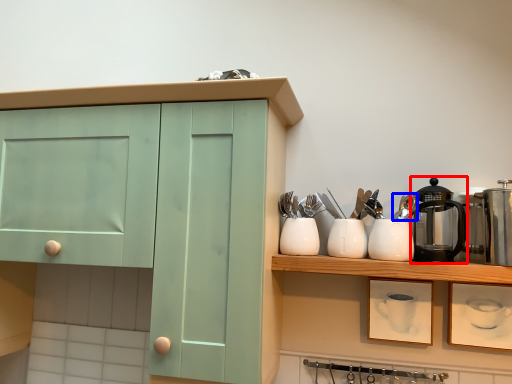
Question: Which of the following is the farthest to the observer, coffeepot (highlighted by a red box) or tableware (highlighted by a blue box)?

Choices:
 (A) coffeepot
 (B) tableware

Answer: (B)